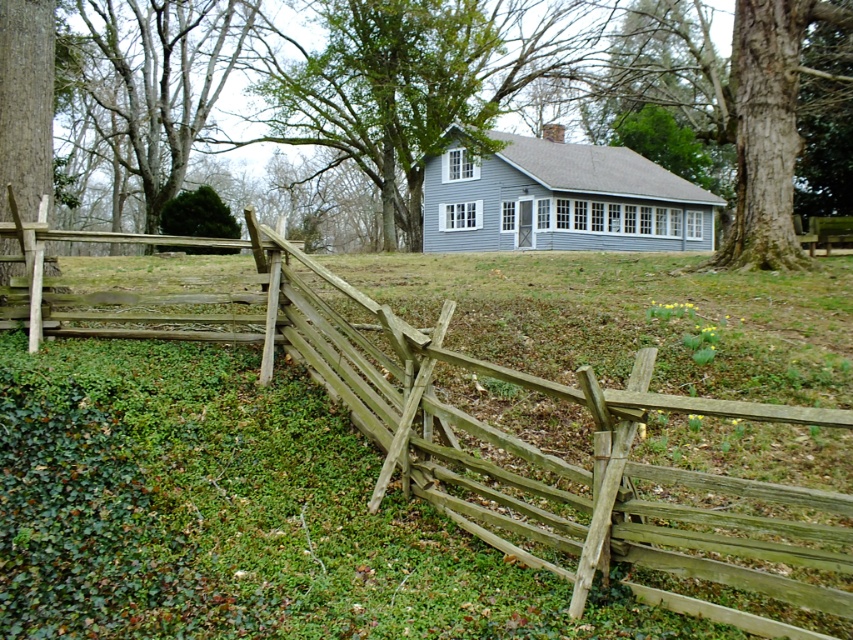
Between point (178, 61) and point (1, 19), which one is positioned behind?

The point (178, 61) is more distant.

Is point (141, 13) farther from camera compared to point (36, 129)?

That is True.

Find the location of `smooth gray bark tree at upper left`. smooth gray bark tree at upper left is located at coordinates (160, 81).

Can you confirm if weathered wood fence at center is thinner than smooth gray bark tree at upper left?

Yes, weathered wood fence at center is thinner than smooth gray bark tree at upper left.

Between weathered wood fence at center and smooth gray bark tree at upper left, which one appears on the right side from the viewer's perspective?

weathered wood fence at center is more to the right.

Which is behind, point (822, 589) or point (102, 28)?

Positioned behind is point (102, 28).

At what (x,y) coordinates should I click in order to perform the action: click on weathered wood fence at center. Please return your answer as a coordinate pair (x, y). Looking at the image, I should click on (447, 454).

Based on the photo, is weathered wood fence at center in front of smooth brown tree trunk at left?

Yes, weathered wood fence at center is closer to the viewer.

Consider the image. Can you confirm if weathered wood fence at center is wider than smooth brown tree trunk at left?

No, weathered wood fence at center is not wider than smooth brown tree trunk at left.

Which is behind, point (779, 406) or point (36, 100)?

Point (36, 100)

At what (x,y) coordinates should I click in order to perform the action: click on weathered wood fence at center. Please return your answer as a coordinate pair (x, y). The height and width of the screenshot is (640, 853). Looking at the image, I should click on (447, 454).